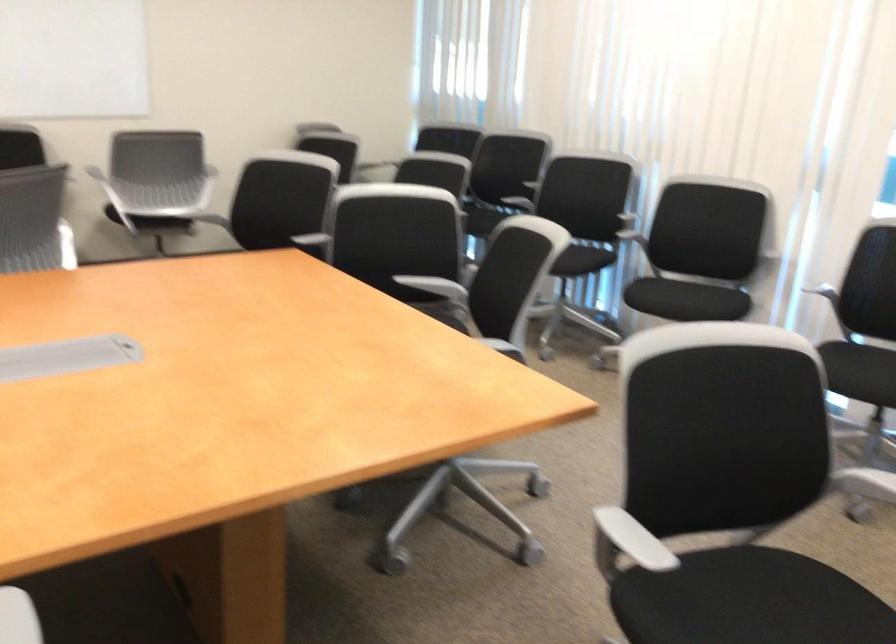
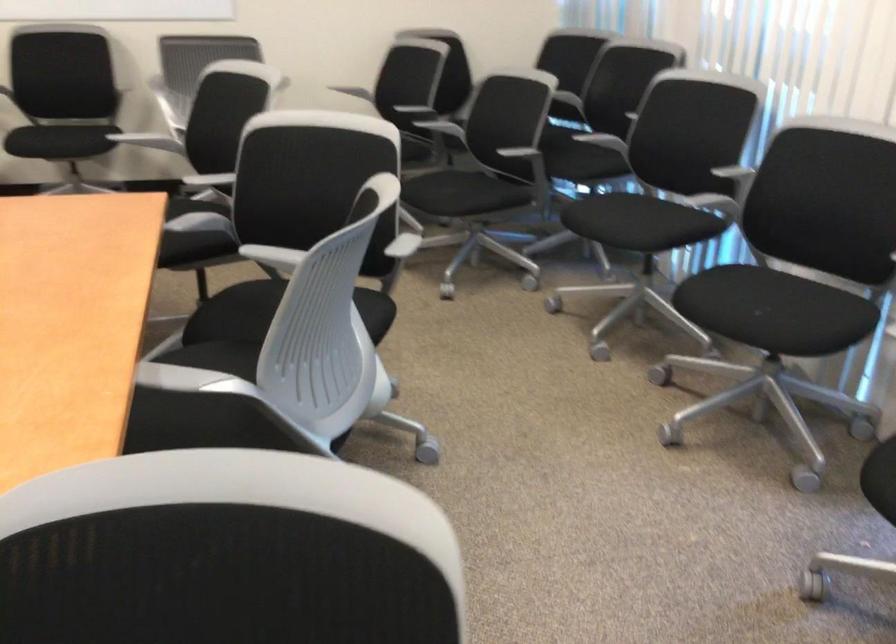
The point at (562, 252) is marked in the first image. Where is the corresponding point in the second image?

(624, 221)